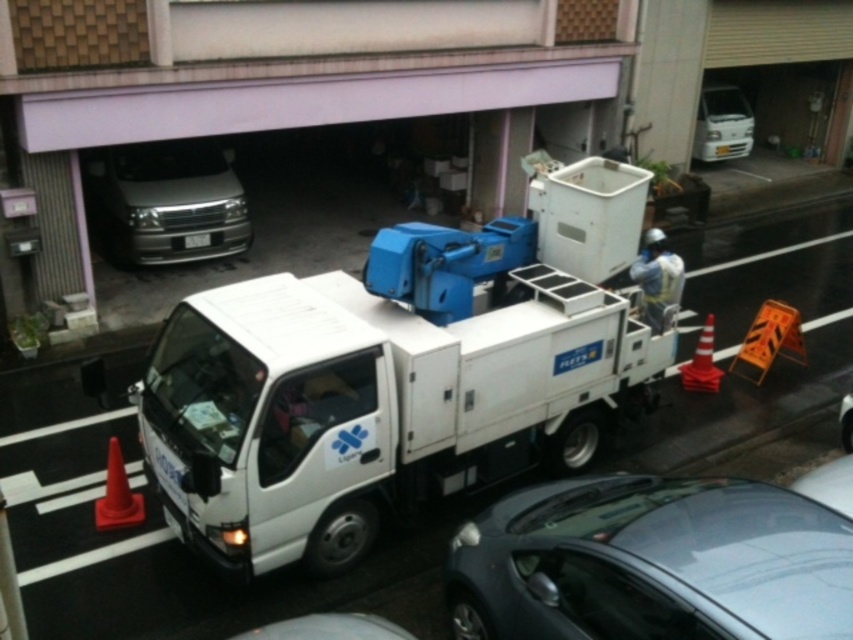
Question: Can you confirm if white matte truck at center is smaller than reflective silver helmet at center?

Choices:
 (A) yes
 (B) no

Answer: (B)

Question: Which object is positioned farthest from the satin silver van at center?

Choices:
 (A) reflective silver helmet at center
 (B) metallic gray car at center
 (C) white plastic license plate at center
 (D) white matte van at upper center

Answer: (D)

Question: Which of these objects is positioned closest to the reflective silver helmet at center?

Choices:
 (A) white matte van at upper center
 (B) orange matte cone at lower left
 (C) white matte truck at center

Answer: (C)

Question: Which of these objects is positioned farthest from the orange matte cone at lower left?

Choices:
 (A) white matte van at upper center
 (B) white plastic license plate at center
 (C) orange traffic cone at lower right

Answer: (A)

Question: Where is satin silver van at center located in relation to orange traffic cone at lower right in the image?

Choices:
 (A) left
 (B) right

Answer: (A)

Question: Does satin silver van at center appear on the right side of white plastic license plate at center?

Choices:
 (A) yes
 (B) no

Answer: (B)